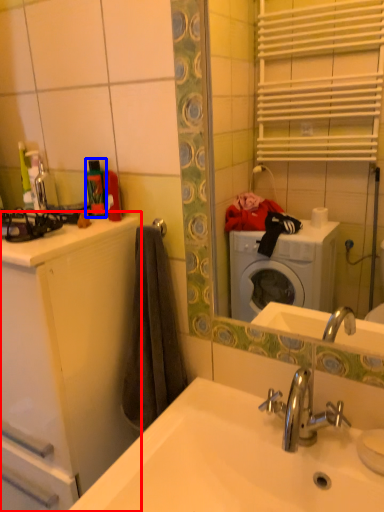
Question: Which object appears closest to the camera in this image, bathroom cabinet (highlighted by a red box) or toiletry (highlighted by a blue box)?

Choices:
 (A) bathroom cabinet
 (B) toiletry

Answer: (A)